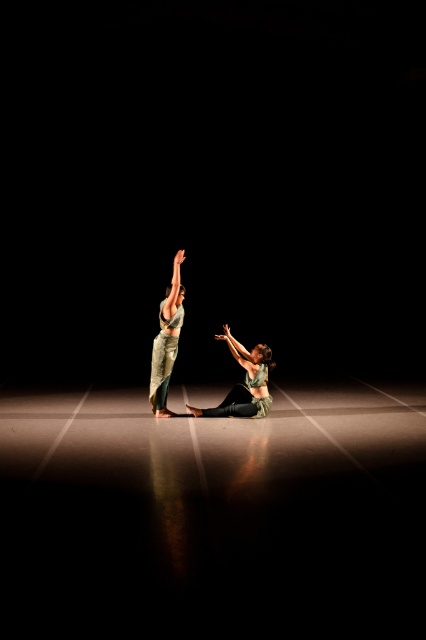
You are a stage designer preparing for a performance. You have two green fabrics available for the dancers. The first is a green fabric skirt at center, and the second is a matte green fabric at center. Which fabric should you choose if you want the skirt to stand out more in the dark background?

The green fabric skirt at center has a larger size compared to the matte green fabric at center, so it would stand out more against the dark background due to its larger size.

You are a costume designer working on a dance performance. You have two pieces of green fabric available for the dancers. The first is labeled as the green fabric skirt at center, and the second is the matte green fabric at center. Based on the scene, which fabric would you choose to ensure it covers more area on the dancer, and why?

The green fabric skirt at center has a larger width than the matte green fabric at center, so it would cover more area on the dancer. Therefore, the green fabric skirt at center should be chosen for better coverage.